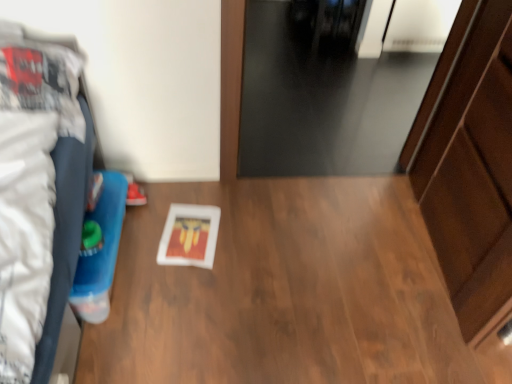
Question: Considering the relative sizes of wooden dresser at right and black glass door at upper center in the image provided, is wooden dresser at right bigger than black glass door at upper center?

Choices:
 (A) yes
 (B) no

Answer: (A)

Question: Considering the relative sizes of wooden dresser at right and black glass door at upper center in the image provided, is wooden dresser at right taller than black glass door at upper center?

Choices:
 (A) yes
 (B) no

Answer: (A)

Question: Does wooden dresser at right have a smaller size compared to black glass door at upper center?

Choices:
 (A) yes
 (B) no

Answer: (B)

Question: Is wooden dresser at right oriented towards black glass door at upper center?

Choices:
 (A) no
 (B) yes

Answer: (A)

Question: Is wooden dresser at right wider than black glass door at upper center?

Choices:
 (A) yes
 (B) no

Answer: (B)

Question: Is wooden dresser at right wider or thinner than wooden table at center?

Choices:
 (A) thin
 (B) wide

Answer: (A)

Question: Considering the positions of point (440, 182) and point (415, 238), is point (440, 182) closer or farther from the camera than point (415, 238)?

Choices:
 (A) farther
 (B) closer

Answer: (B)

Question: From a real-world perspective, is wooden dresser at right physically located above or below wooden table at center?

Choices:
 (A) below
 (B) above

Answer: (B)

Question: From their relative heights in the image, would you say wooden dresser at right is taller or shorter than wooden table at center?

Choices:
 (A) tall
 (B) short

Answer: (A)

Question: In the image, is wooden table at center positioned in front of or behind matte red shoe at lower left?

Choices:
 (A) behind
 (B) front

Answer: (B)

Question: Considering the positions of wooden table at center and matte red shoe at lower left in the image, is wooden table at center bigger or smaller than matte red shoe at lower left?

Choices:
 (A) big
 (B) small

Answer: (A)

Question: In terms of height, does wooden table at center look taller or shorter compared to matte red shoe at lower left?

Choices:
 (A) short
 (B) tall

Answer: (A)

Question: From a real-world perspective, is wooden table at center positioned above or below matte red shoe at lower left?

Choices:
 (A) above
 (B) below

Answer: (B)

Question: In terms of height, does wooden table at center look taller or shorter compared to black glass door at upper center?

Choices:
 (A) short
 (B) tall

Answer: (B)

Question: From a real-world perspective, is wooden table at center positioned above or below black glass door at upper center?

Choices:
 (A) below
 (B) above

Answer: (B)